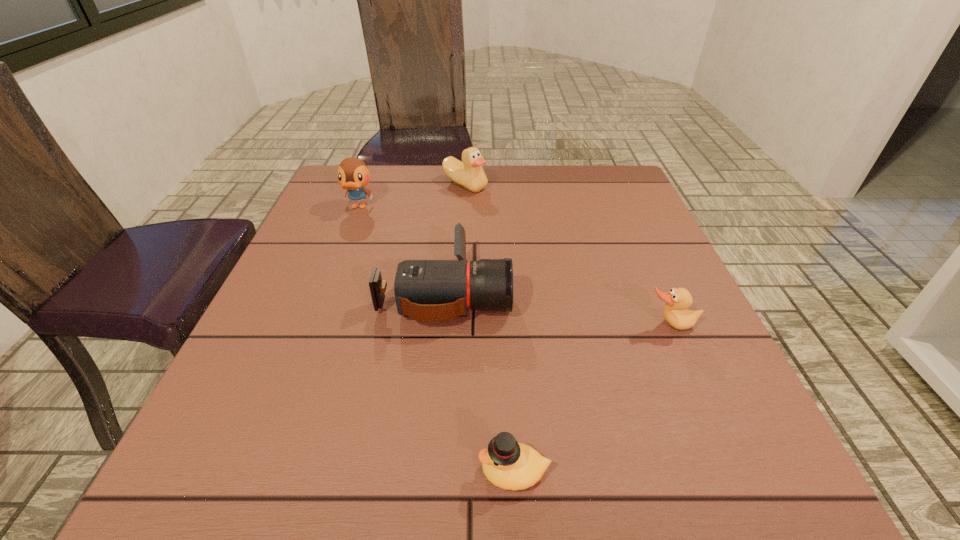
The height and width of the screenshot is (540, 960). Identify the location of vacant region between the farthest object and the nearest object. (490, 328).

This screenshot has height=540, width=960. I want to click on free spot between the second nearest duck and the farthest duck, so click(x=567, y=255).

At what (x,y) coordinates should I click in order to perform the action: click on the second closest object relative to the nearest duck. Please return your answer as a coordinate pair (x, y). Looking at the image, I should click on (675, 312).

Locate which object is the closest to the leftmost object. Please provide its 2D coordinates. Your answer should be formatted as a tuple, i.e. [(x, y)], where the tuple contains the x and y coordinates of a point satisfying the conditions above.

[(469, 174)]

Identify the location of the closest duck relative to the third farthest duck. (507, 464).

Identify which duck is located as the second nearest to the fourth nearest object. Please provide its 2D coordinates. Your answer should be formatted as a tuple, i.e. [(x, y)], where the tuple contains the x and y coordinates of a point satisfying the conditions above.

[(507, 464)]

Image resolution: width=960 pixels, height=540 pixels. What are the coordinates of `free space that satisfies the following two spatial constraints: 1. at the beak of the farthest duck; 2. on the lens of the camcorder` in the screenshot? It's located at click(x=460, y=291).